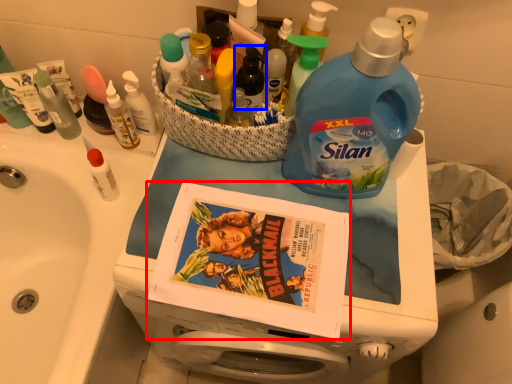
Question: Which of the following is the farthest to the observer, comic book (highlighted by a red box) or bottle (highlighted by a blue box)?

Choices:
 (A) comic book
 (B) bottle

Answer: (B)